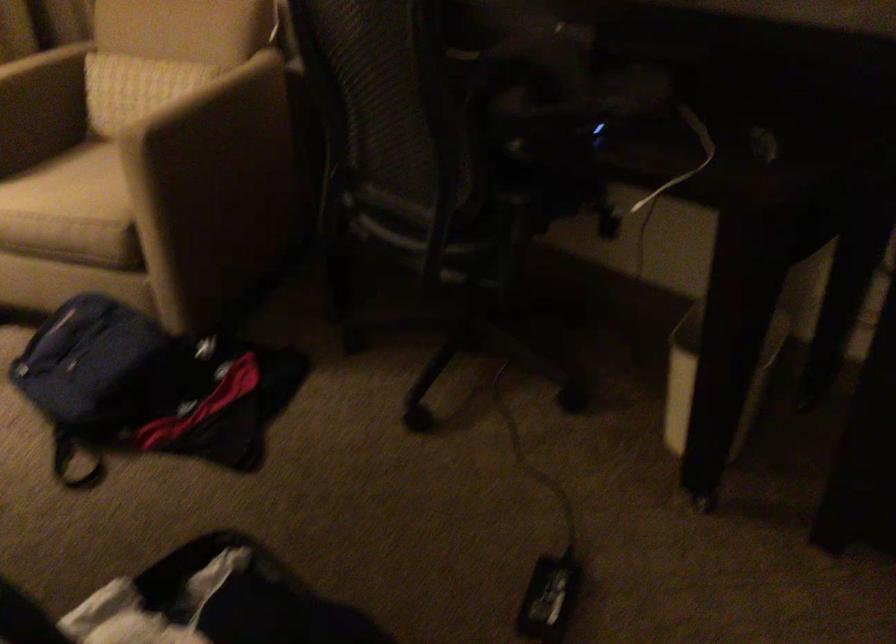
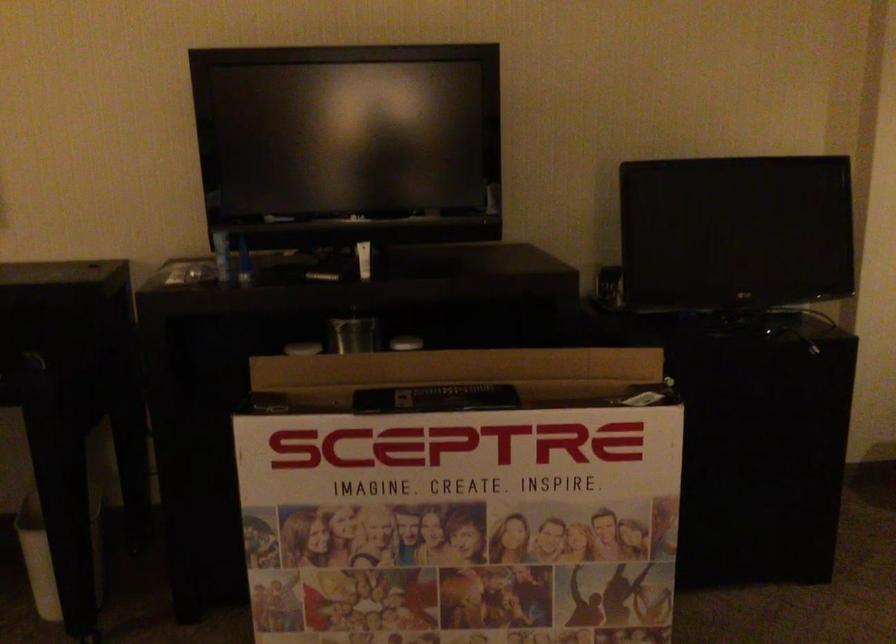
Question: The first image is from the beginning of the video and the second image is from the end. How did the camera likely rotate when shooting the video?

Choices:
 (A) Left
 (B) Right
 (C) Up
 (D) Down

Answer: (B)